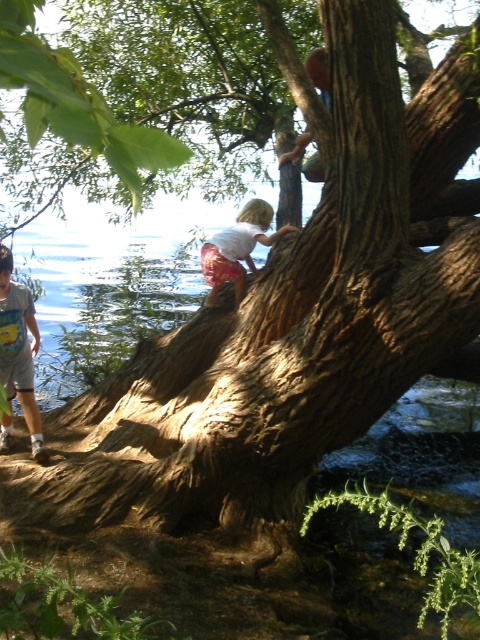
Does light blue t-shirt at lower left have a greater width compared to white cotton shirt at upper center?

No.

Is light blue t-shirt at lower left to the left of white cotton shirt at upper center from the viewer's perspective?

Correct, you'll find light blue t-shirt at lower left to the left of white cotton shirt at upper center.

Find the location of a particular element. This screenshot has height=640, width=480. light blue t-shirt at lower left is located at coordinates (19, 349).